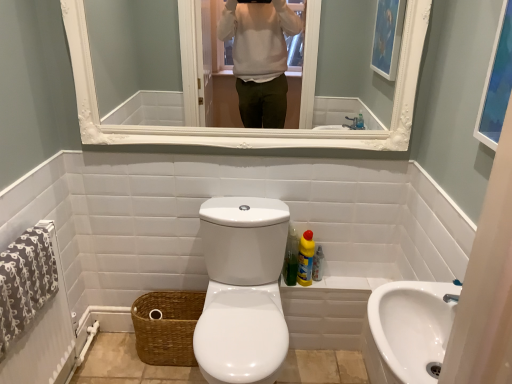
Image resolution: width=512 pixels, height=384 pixels. In order to click on free space on the front side of brown woven basket at lower left in this screenshot , I will do `click(165, 370)`.